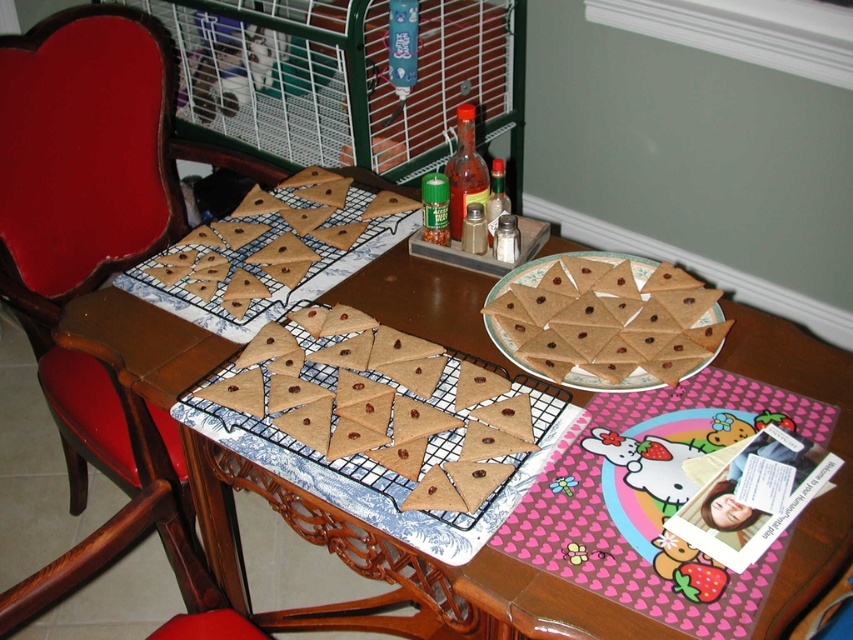
You are standing at the front of the table and want to place a new treat on the table. There are two points marked as point 1 at coordinate (149, 99) and point 2 at coordinate (117, 520). Which point is closer to you?

Point 2 at coordinate (117, 520) is closer to you since it is in front of point 1 at coordinate (149, 99).

Looking at this image, you are a baker who needs to place a small decorative bowl between the brown matte cookies at center and the brown matte triangle crackers at center. Based on their positions, where should you place the bowl?

The bowl should be placed between the brown matte cookies at center and the brown matte triangle crackers at center, as the cookies are to the left of the crackers.

You are a guest at a dinner party and need to choose a seat. You prefer a taller chair. Which one should you choose between the wooden chair at left and the brown wood chair at lower left?

The wooden chair at left is taller than the brown wood chair at lower left, so you should choose the wooden chair at left.